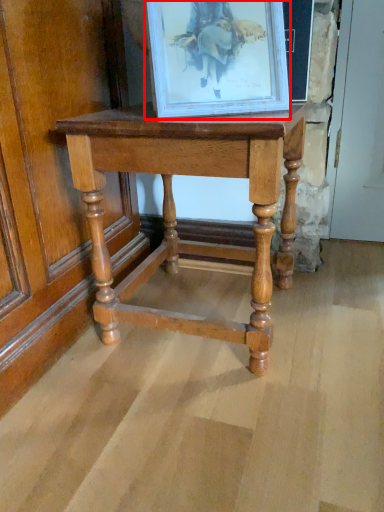
Question: Observing the image, what is the correct spatial positioning of picture frame (annotated by the red box) in reference to table?

Choices:
 (A) left
 (B) right

Answer: (B)